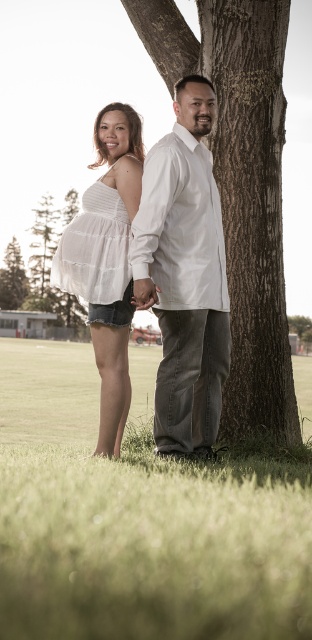
Question: Which of the following is the farthest from the observer?

Choices:
 (A) brown rough tree trunk at center
 (B) white sheer dress at center
 (C) green grass at lower center
 (D) green leafy tree at left

Answer: (D)

Question: Which point is closer to the camera?

Choices:
 (A) (97, 230)
 (B) (132, 289)
 (C) (184, 592)
 (D) (271, 45)

Answer: (C)

Question: Based on their relative distances, which object is nearer to the green leafy tree at left?

Choices:
 (A) brown rough tree trunk at center
 (B) white cotton dress at left

Answer: (A)

Question: Does white cotton shirt at center have a greater width compared to matte white hand at center?

Choices:
 (A) no
 (B) yes

Answer: (B)

Question: From the image, what is the correct spatial relationship of brown rough tree trunk at center in relation to green leafy tree at left?

Choices:
 (A) above
 (B) below

Answer: (B)

Question: Is brown rough tree trunk at center positioned behind white cotton dress at left?

Choices:
 (A) no
 (B) yes

Answer: (B)